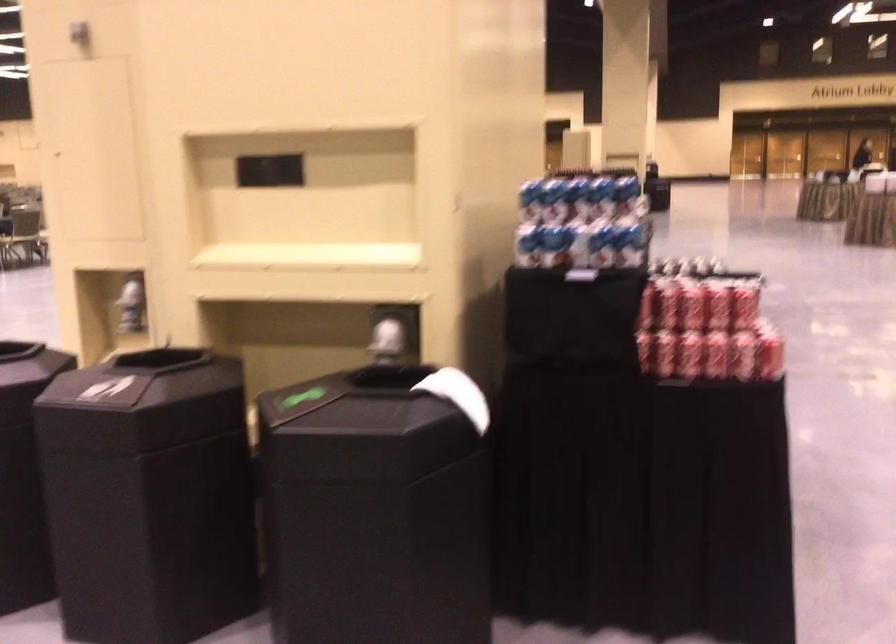
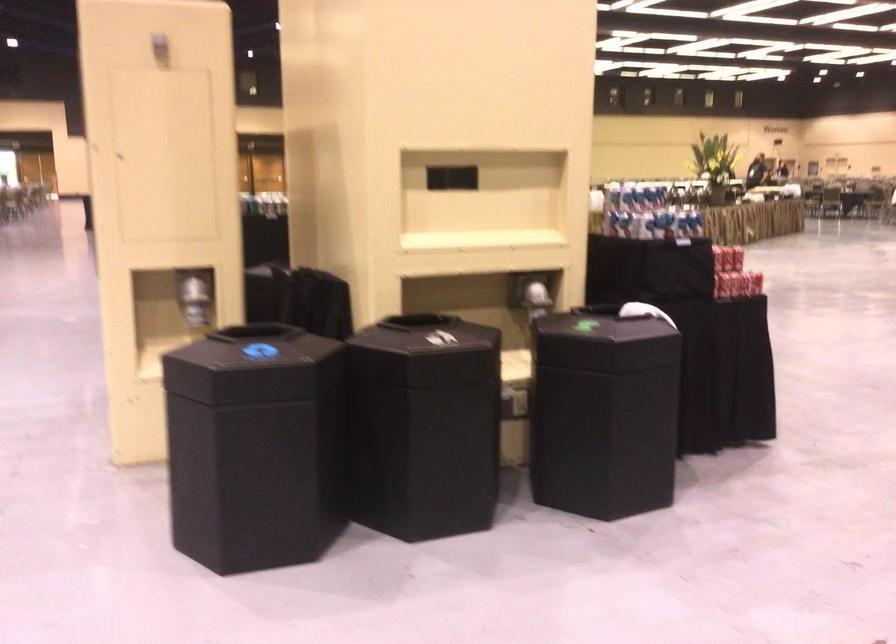
Find the pixel in the second image that matches the point at 316,424 in the first image.

(605, 341)